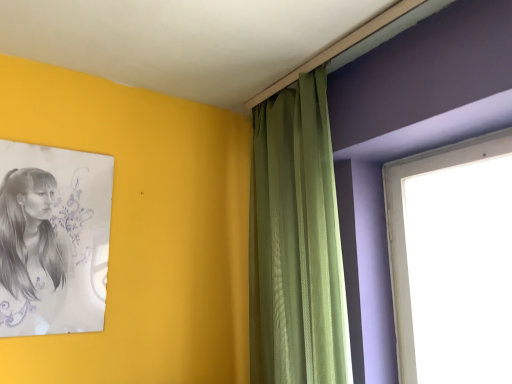
Question: Is black paper portrait at left far away from green textured curtain at upper center?

Choices:
 (A) no
 (B) yes

Answer: (A)

Question: Could green textured curtain at upper center be considered to be inside black paper portrait at left?

Choices:
 (A) yes
 (B) no

Answer: (B)

Question: Can you confirm if black paper portrait at left is bigger than green textured curtain at upper center?

Choices:
 (A) no
 (B) yes

Answer: (A)

Question: Does black paper portrait at left lie in front of green textured curtain at upper center?

Choices:
 (A) yes
 (B) no

Answer: (B)

Question: Considering the relative positions of black paper portrait at left and green textured curtain at upper center in the image provided, is black paper portrait at left to the left of green textured curtain at upper center from the viewer's perspective?

Choices:
 (A) no
 (B) yes

Answer: (B)

Question: From a real-world perspective, is black paper portrait at left positioned under green textured curtain at upper center based on gravity?

Choices:
 (A) no
 (B) yes

Answer: (B)

Question: From a real-world perspective, is green textured curtain at upper center physically below black paper portrait at left?

Choices:
 (A) no
 (B) yes

Answer: (A)

Question: From the image's perspective, is green textured curtain at upper center on top of black paper portrait at left?

Choices:
 (A) no
 (B) yes

Answer: (B)

Question: Would you consider green textured curtain at upper center to be distant from black paper portrait at left?

Choices:
 (A) no
 (B) yes

Answer: (A)

Question: Does green textured curtain at upper center come behind black paper portrait at left?

Choices:
 (A) no
 (B) yes

Answer: (A)

Question: Is green textured curtain at upper center at the right side of black paper portrait at left?

Choices:
 (A) no
 (B) yes

Answer: (B)

Question: Is green textured curtain at upper center positioned in front of black paper portrait at left?

Choices:
 (A) no
 (B) yes

Answer: (B)

Question: From a real-world perspective, is green textured curtain at upper center above or below black paper portrait at left?

Choices:
 (A) below
 (B) above

Answer: (B)